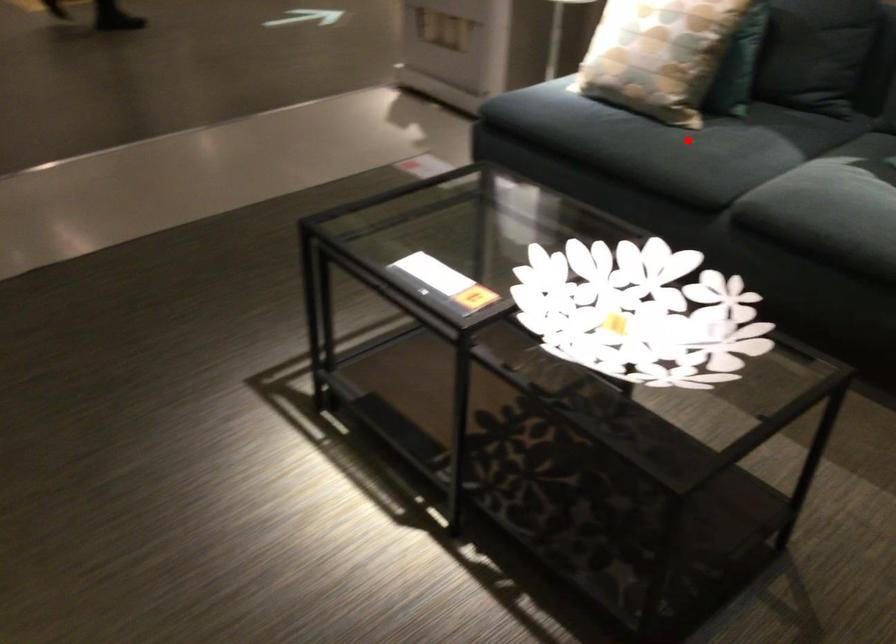
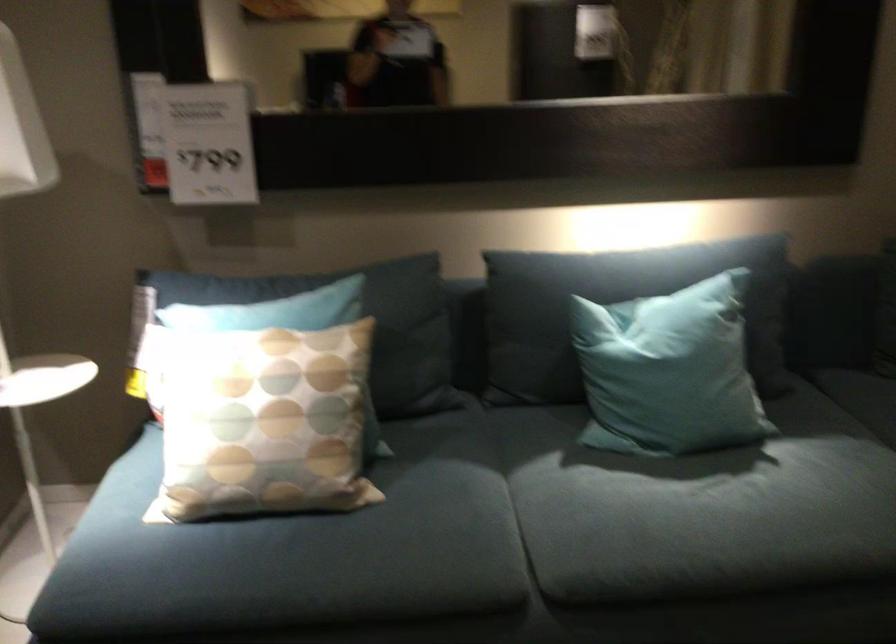
Question: I am providing you with two images of the same scene from different viewpoints. In image1, a red point is highlighted. Considering the same 3D point in image2, which of the following is correct?

Choices:
 (A) It is closer
 (B) It is farther

Answer: (A)